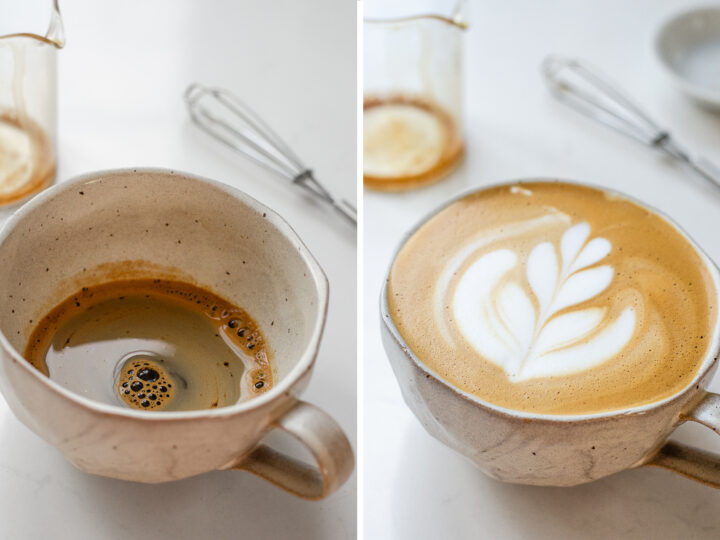
Locate an element on the screen. The image size is (720, 540). empty mug is located at coordinates (194, 220).